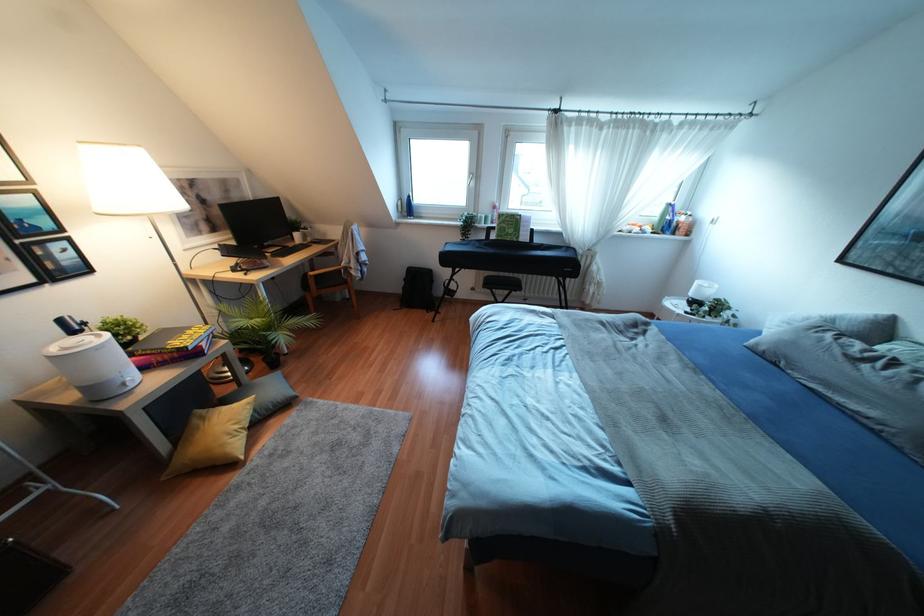
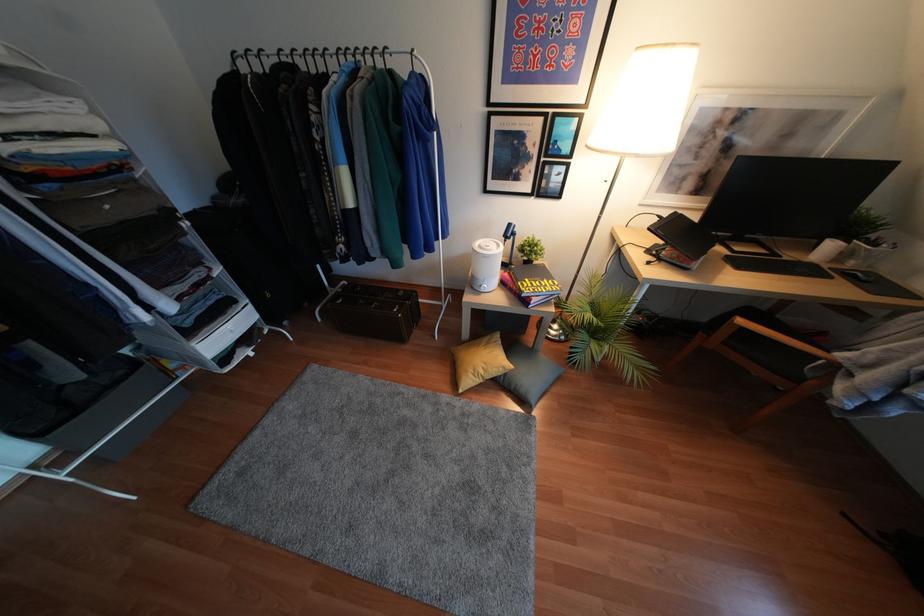
The point at (225, 251) is marked in the first image. Where is the corresponding point in the second image?

(666, 224)